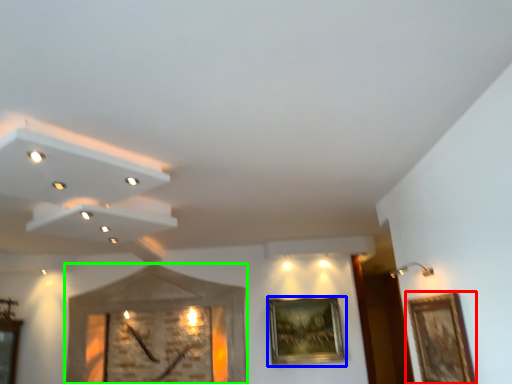
Question: Considering the real-world distances, which object is closest to picture frame (highlighted by a red box)? picture frame (highlighted by a blue box) or clock (highlighted by a green box).

Choices:
 (A) picture frame
 (B) clock

Answer: (A)